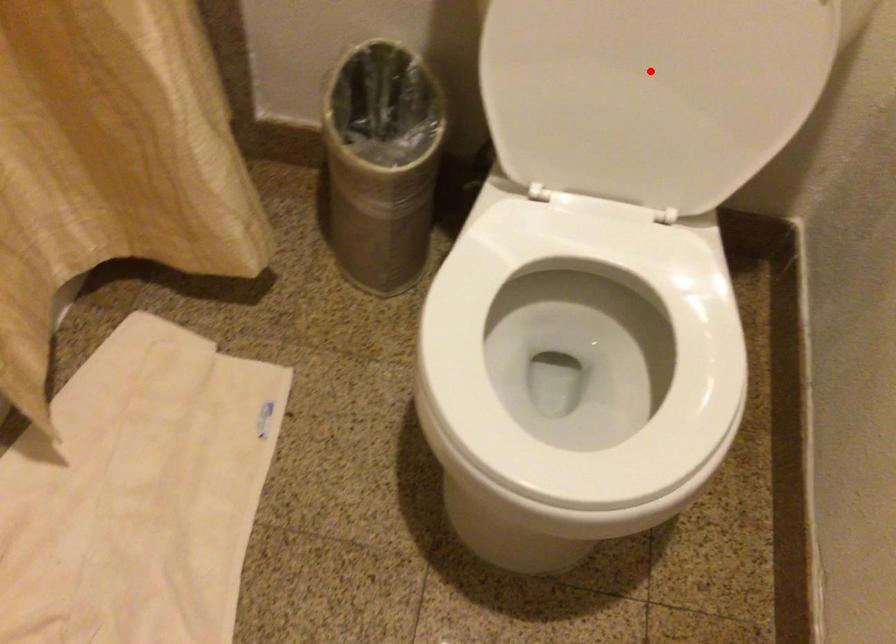
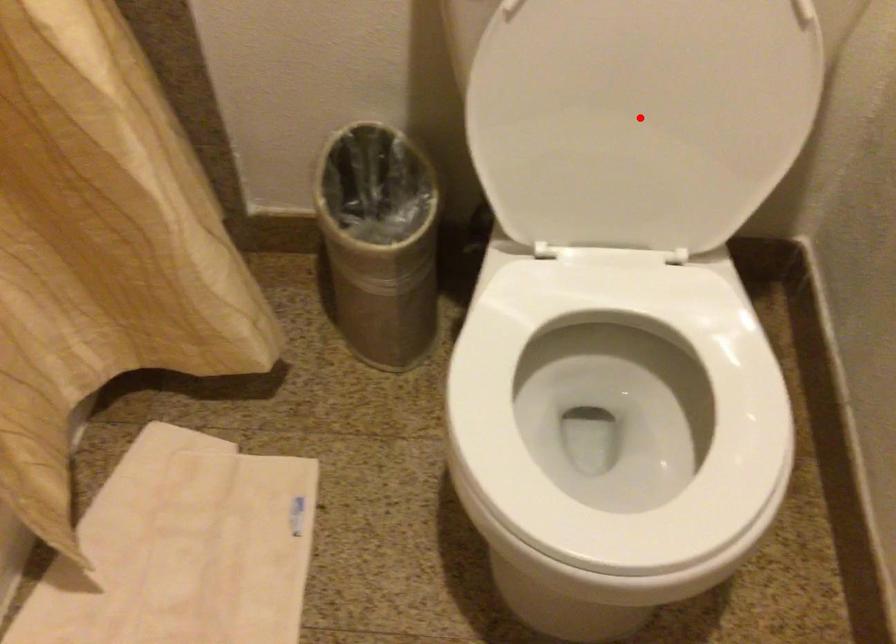
I am providing you with two images of the same scene from different viewpoints. A red point is marked on the first image and another point is marked on the second image. Do the highlighted points in image1 and image2 indicate the same real-world spot?

Yes